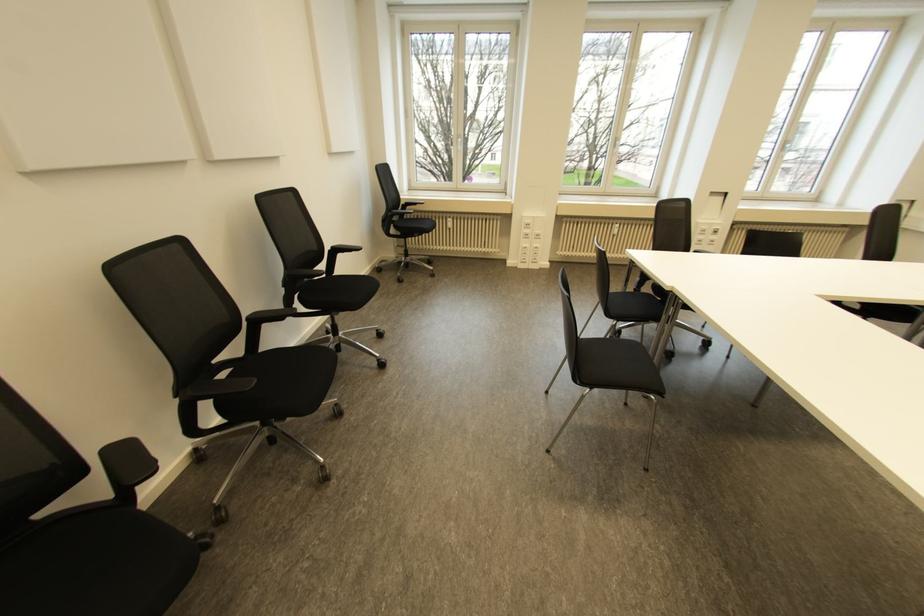
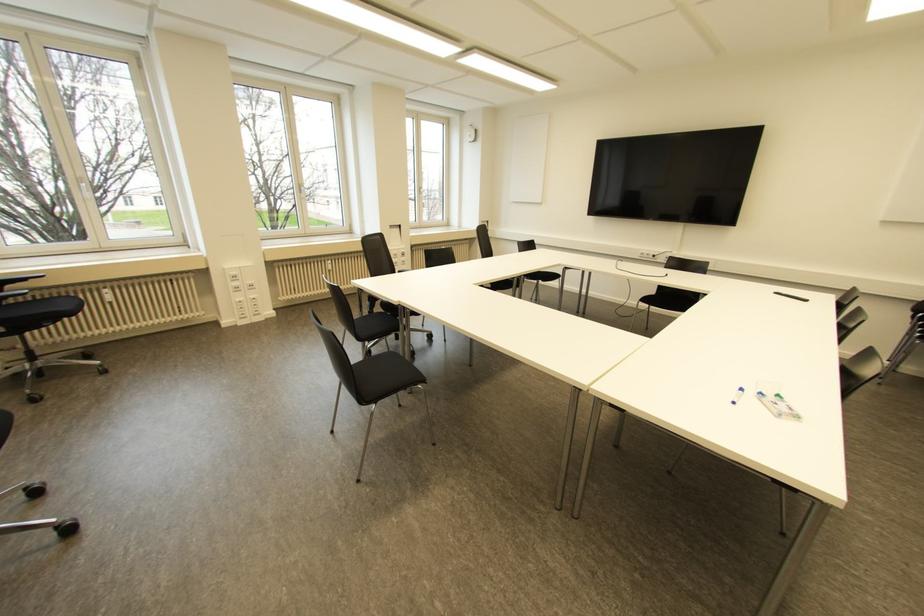
Find the pixel in the second image that matches (614,231) in the first image.

(330, 267)